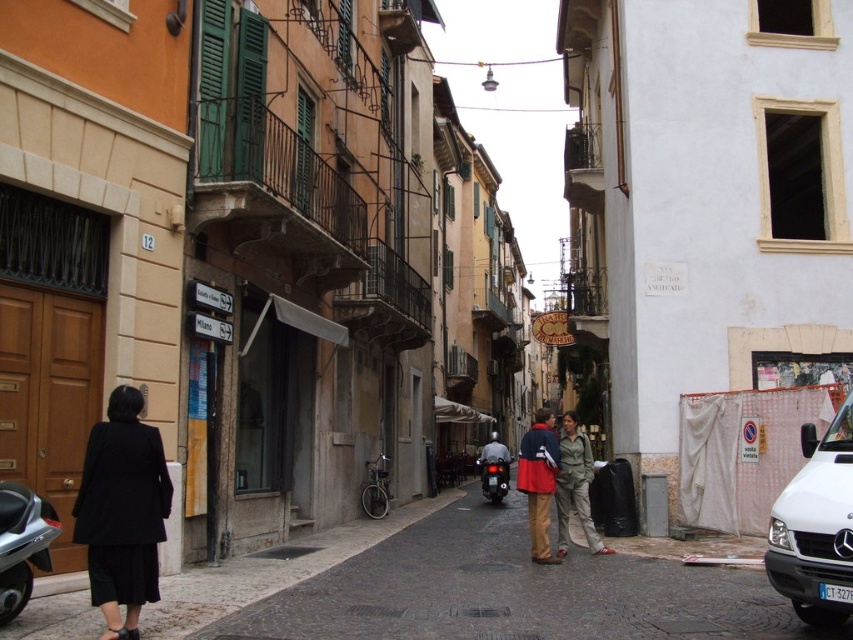
Question: Can you confirm if matte black scooter at center is positioned above red fabric coat at center?

Choices:
 (A) no
 (B) yes

Answer: (A)

Question: Which point is farther from the camera taking this photo?

Choices:
 (A) (592, 520)
 (B) (532, 536)
 (C) (4, 525)
 (D) (583, 604)

Answer: (A)

Question: Where is black wool coat at lower left located in relation to white matte van at lower right in the image?

Choices:
 (A) left
 (B) right

Answer: (A)

Question: Is black wool coat at lower left in front of white matte van at lower right?

Choices:
 (A) no
 (B) yes

Answer: (A)

Question: Which object is closer to the camera taking this photo?

Choices:
 (A) matte black scooter at center
 (B) khaki cotton pants at center

Answer: (A)

Question: Which point appears closest to the camera in this image?

Choices:
 (A) (120, 451)
 (B) (527, 432)
 (C) (825, 604)
 (D) (25, 593)

Answer: (C)